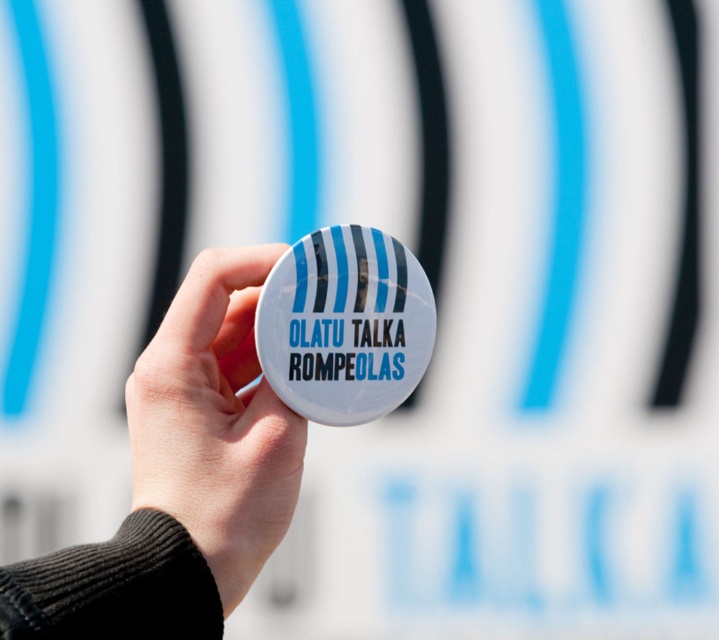
Can you confirm if white matte button at center is thinner than white glossy button at center?

No.

Locate an element on the screen. white matte button at center is located at coordinates (215, 422).